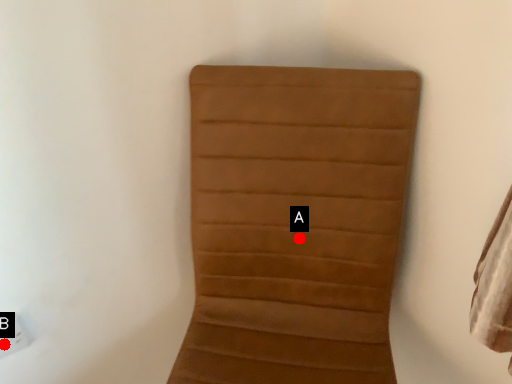
Question: Two points are circled on the image, labeled by A and B beside each circle. Which point is farther from the camera taking this photo?

Choices:
 (A) A is further
 (B) B is further

Answer: (B)